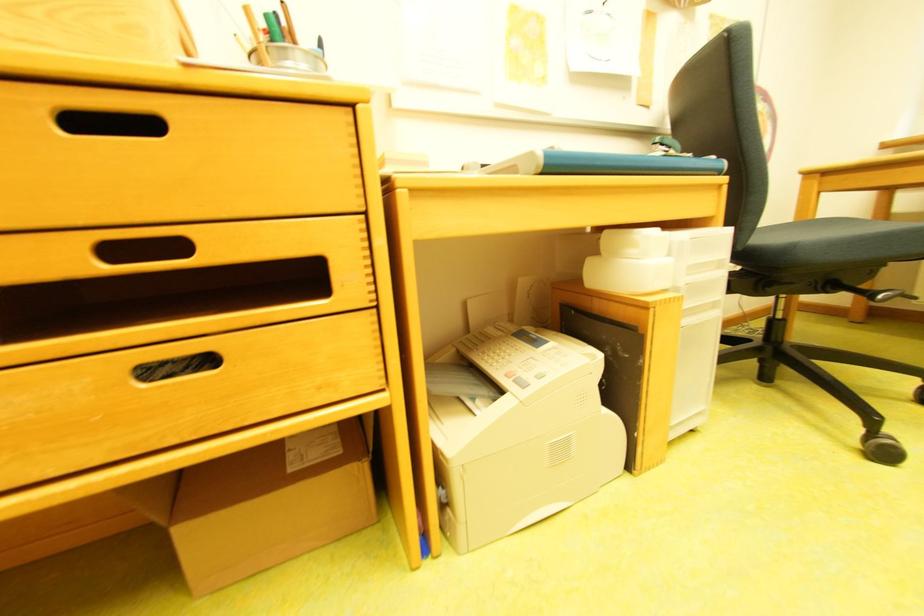
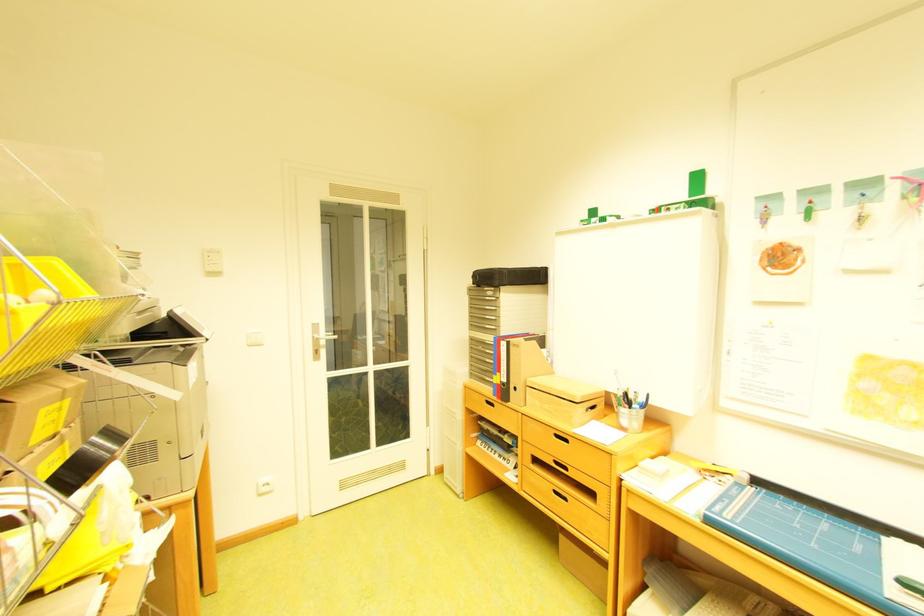
In the second image, find the point that corresponds to point (118, 270) in the first image.

(565, 467)